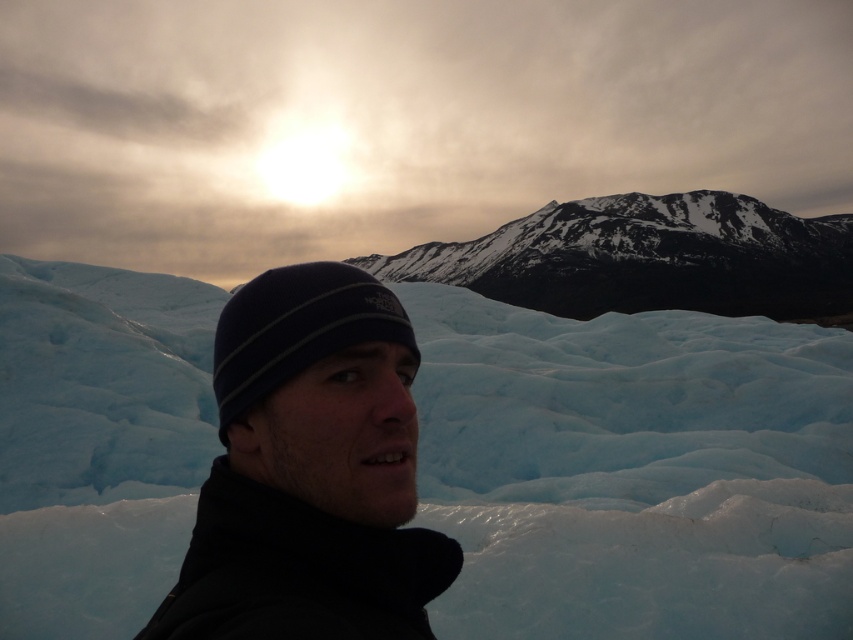
Is blue ice glacier at center positioned at the back of black knit cap at center?

Yes, blue ice glacier at center is behind black knit cap at center.

Which is behind, point (113, 541) or point (426, 556)?

The point (113, 541) is behind.

Locate an element on the screen. Image resolution: width=853 pixels, height=640 pixels. blue ice glacier at center is located at coordinates (634, 470).

Can you confirm if blue ice glacier at center is positioned above black knit beanie at center?

No, blue ice glacier at center is not above black knit beanie at center.

Is point (77, 608) positioned behind point (265, 364)?

That is True.

Who is more distant from viewer, (x=801, y=541) or (x=289, y=372)?

The point (x=801, y=541) is behind.

At what (x,y) coordinates should I click in order to perform the action: click on blue ice glacier at center. Please return your answer as a coordinate pair (x, y). The width and height of the screenshot is (853, 640). Looking at the image, I should click on (634, 470).

Between snowy rocky mountain at center and black knit beanie at center, which one appears on the right side from the viewer's perspective?

From the viewer's perspective, snowy rocky mountain at center appears more on the right side.

Is point (558, 305) more distant than point (345, 340)?

Yes, it is.

The height and width of the screenshot is (640, 853). Identify the location of snowy rocky mountain at center. (648, 259).